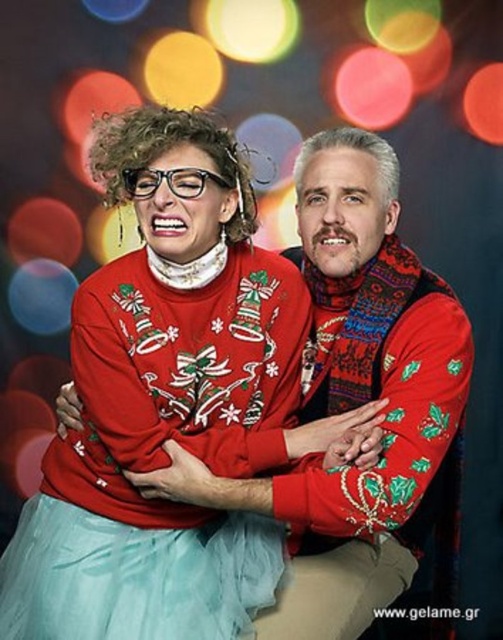
Question: Does matte red sweater at center have a larger size compared to light blue tulle ballet skirt at lower left?

Choices:
 (A) no
 (B) yes

Answer: (B)

Question: Can you confirm if matte red sweater at center is wider than light blue tulle ballet skirt at lower left?

Choices:
 (A) yes
 (B) no

Answer: (A)

Question: Which object is closer to the camera taking this photo?

Choices:
 (A) matte red sweater at center
 (B) light blue tulle ballet skirt at lower left

Answer: (B)

Question: Which point is farther to the camera?

Choices:
 (A) tap(135, 285)
 (B) tap(46, 636)

Answer: (A)

Question: Which point is farther to the camera?

Choices:
 (A) matte red sweater at center
 (B) light blue tulle ballet skirt at lower left

Answer: (A)

Question: Can you confirm if matte red sweater at center is positioned above light blue tulle ballet skirt at lower left?

Choices:
 (A) no
 (B) yes

Answer: (B)